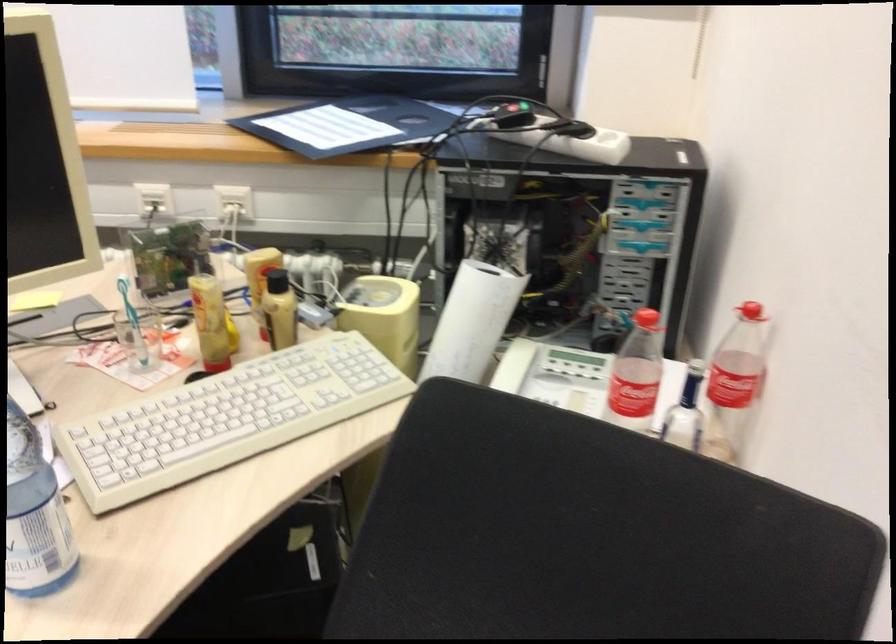
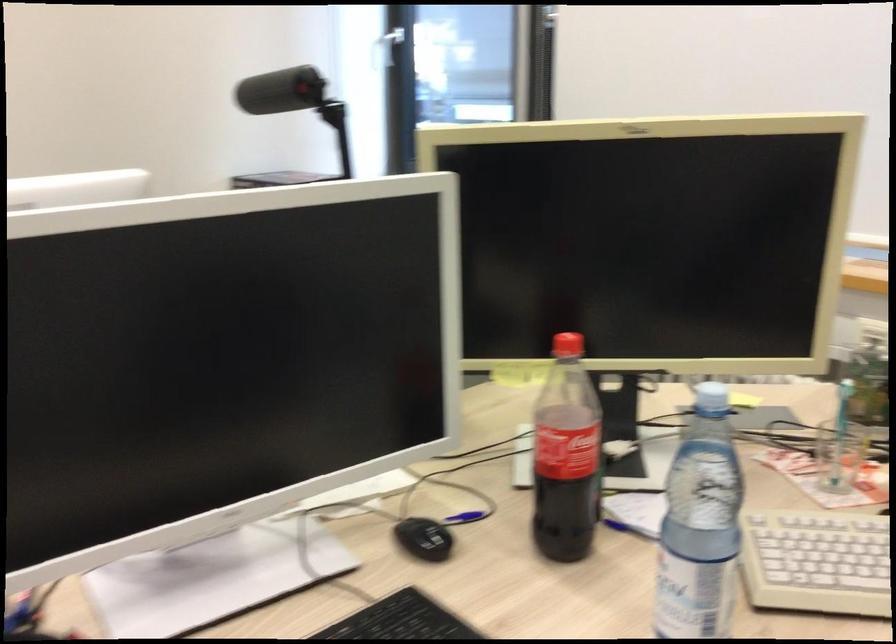
The point at (144,455) is marked in the first image. Where is the corresponding point in the second image?

(815, 562)